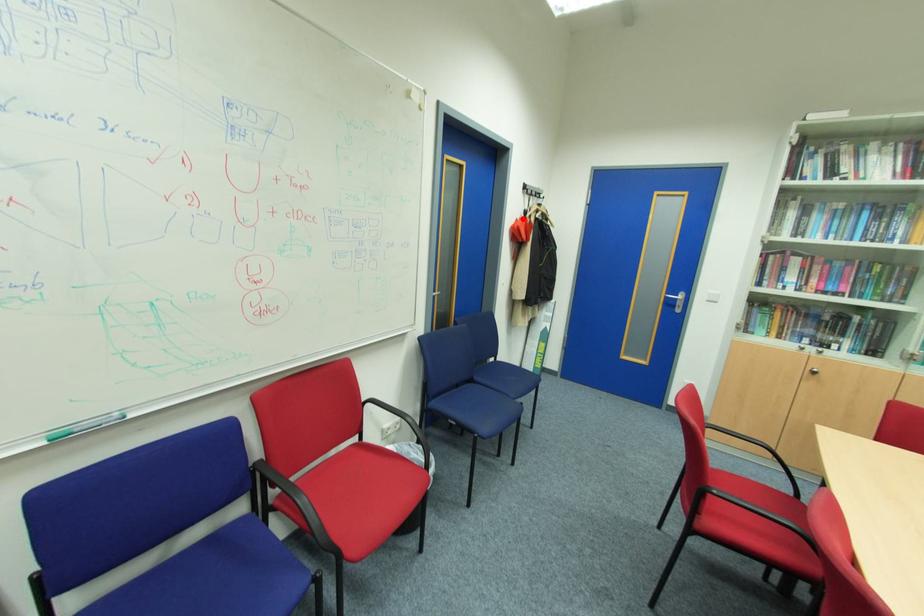
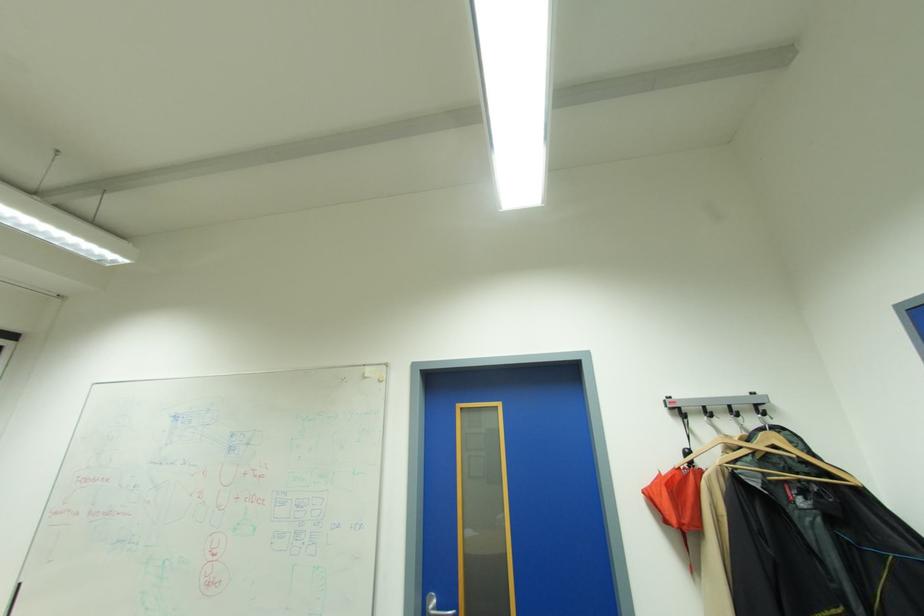
Question: A red point is marked in image1. In image2, is the corresponding 3D point closer to the camera or farther? Reply with the corresponding letter.

Choices:
 (A) The corresponding 3D point is closer.
 (B) The corresponding 3D point is farther.

Answer: (B)